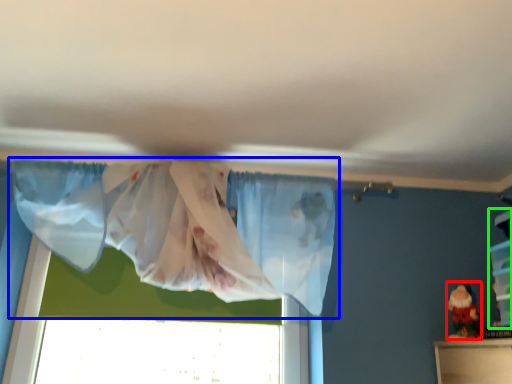
Question: Based on their relative distances, which object is farther from toy (highlighted by a red box)? Choose from curtain (highlighted by a blue box) and shelf (highlighted by a green box).

Choices:
 (A) curtain
 (B) shelf

Answer: (A)